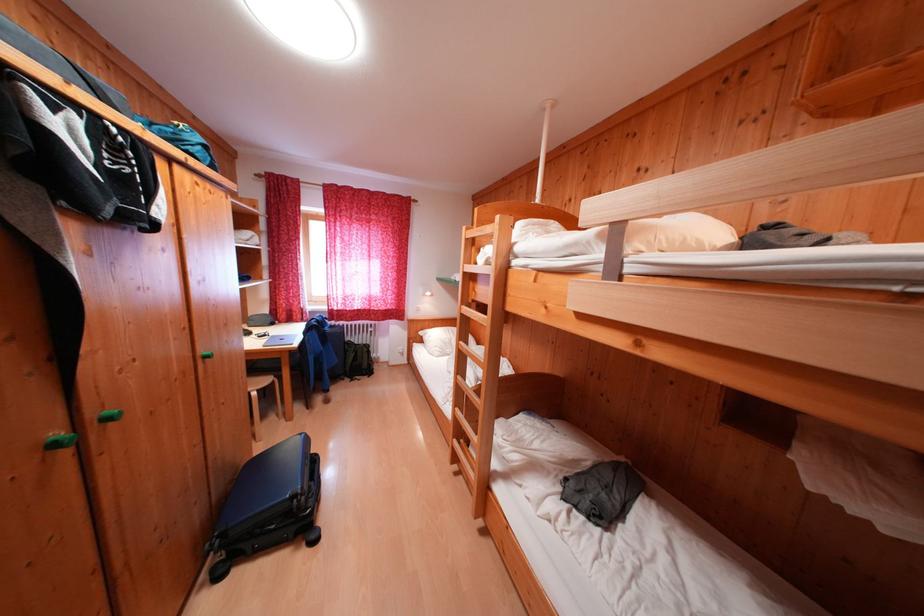
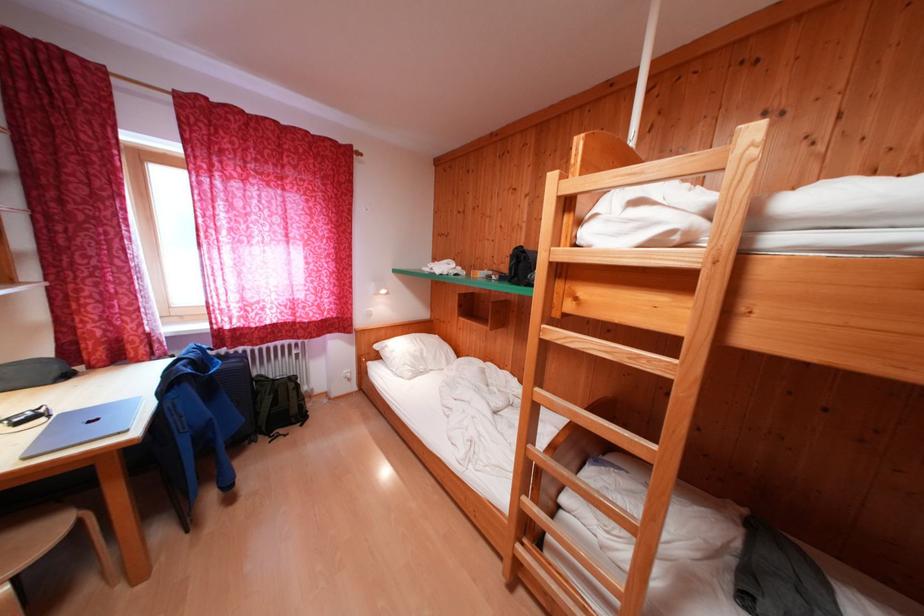
Find the pixel in the second image that matches pixel 430 345 in the first image.

(385, 361)